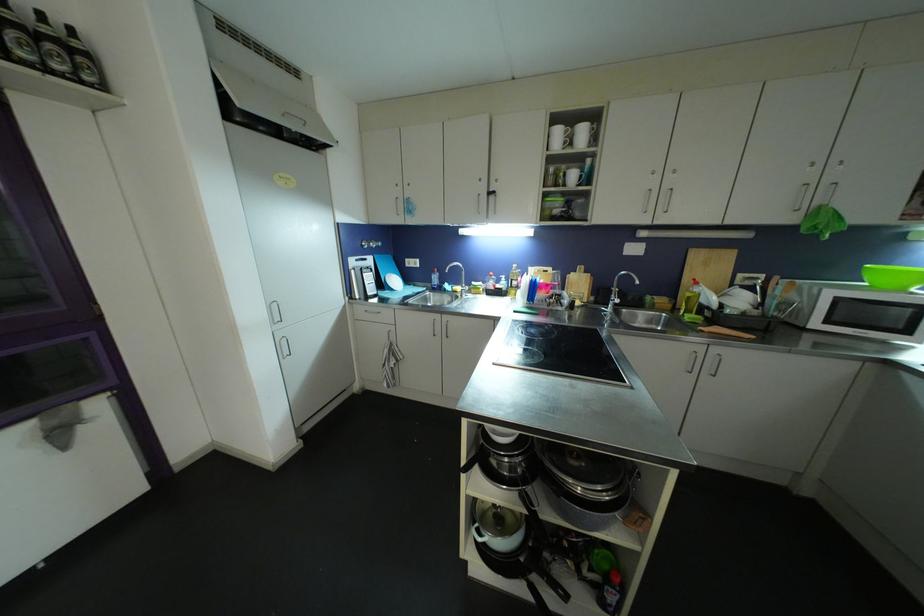
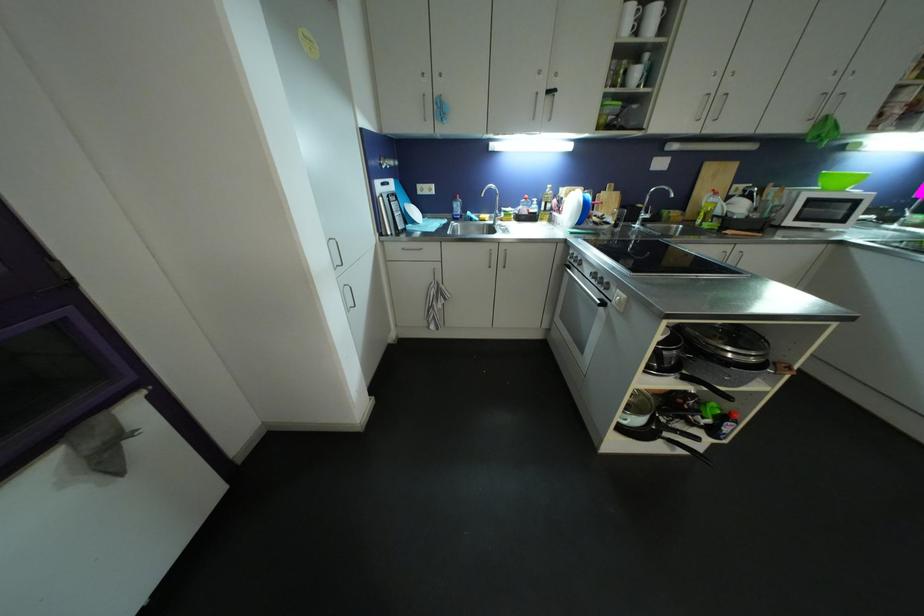
Locate, in the second image, the point that corresponds to (565,132) in the first image.

(638, 13)